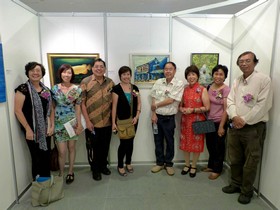
I want to click on wall behind people, so click(131, 38).